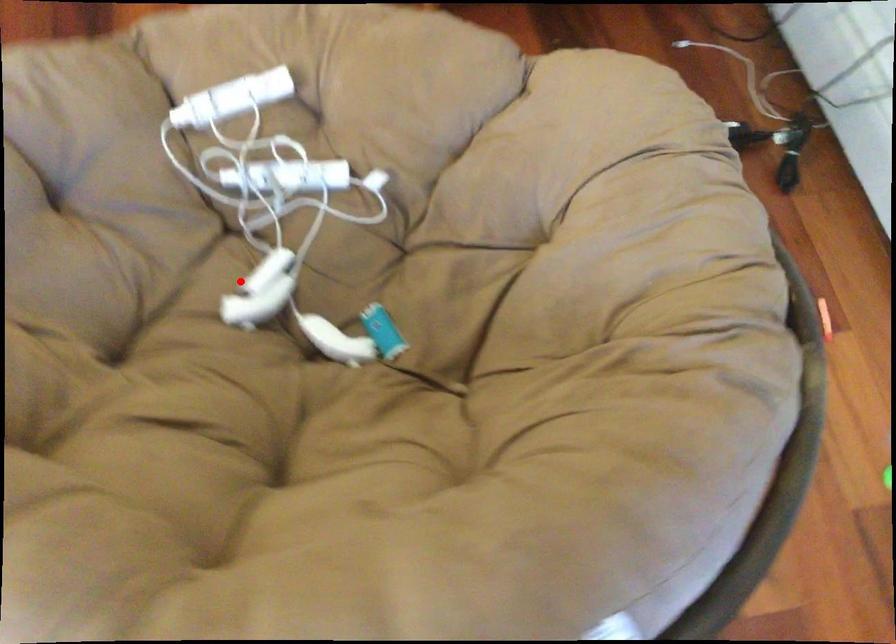
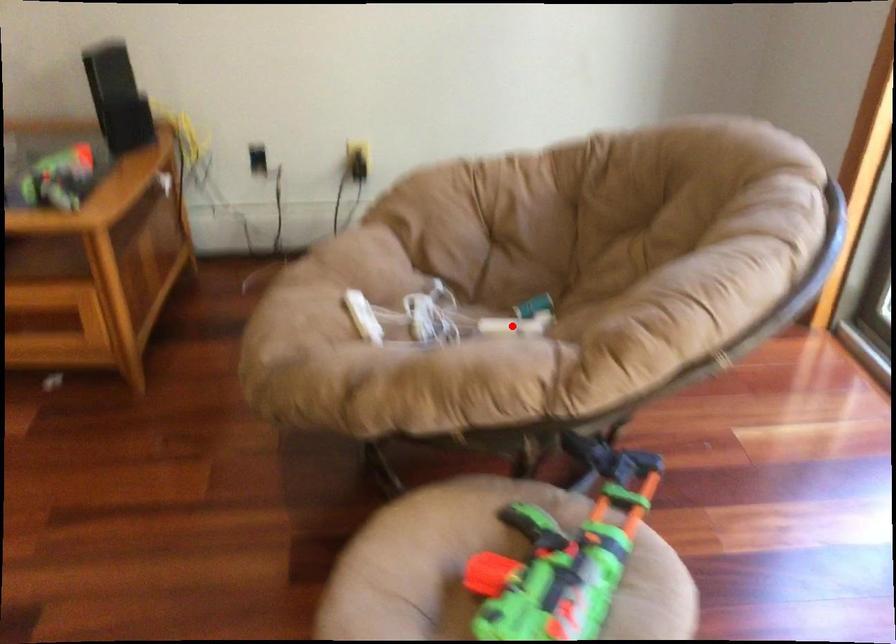
I am providing you with two images of the same scene from different viewpoints. A red point is marked on the first image and another point is marked on the second image. Are the points marked in image1 and image2 representing the same 3D position?

Yes